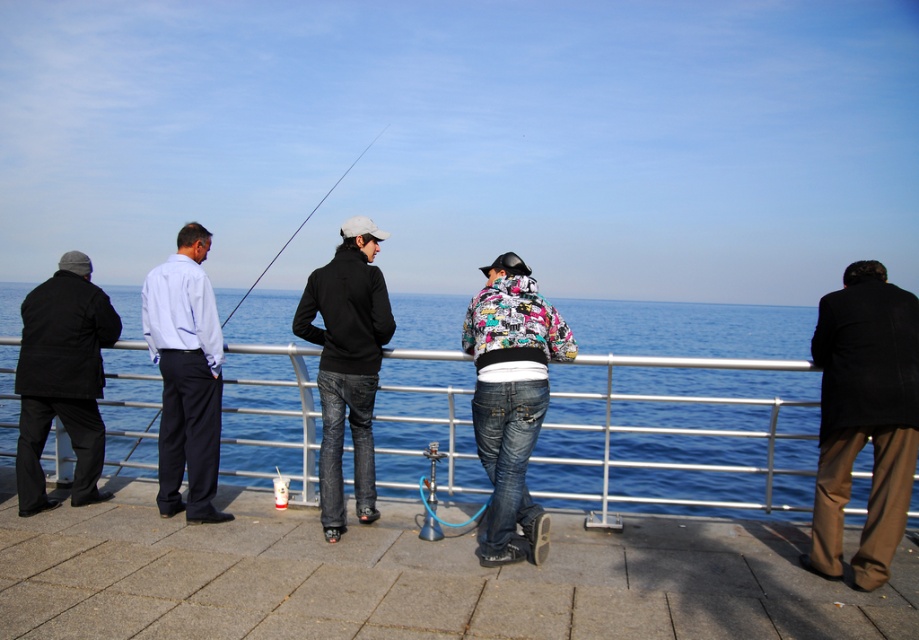
In the scene shown: Is concrete dock at center positioned behind black matte jacket at center?

That is False.

Which is below, concrete dock at center or black matte jacket at center?

concrete dock at center

Does point (290, 512) come behind point (316, 305)?

Yes.

This screenshot has height=640, width=919. Identify the location of concrete dock at center. click(416, 579).

The image size is (919, 640). I want to click on concrete dock at center, so click(416, 579).

Which is behind, point (640, 552) or point (89, 458)?

The point (89, 458) is more distant.

What are the coordinates of `concrete dock at center` in the screenshot? It's located at (416, 579).

Who is positioned more to the right, concrete dock at center or brown woolen coat at right?

brown woolen coat at right

In the scene shown: Who is more forward, (183, 621) or (905, 317)?

Point (183, 621) is more forward.

Where is `concrete dock at center`? This screenshot has height=640, width=919. concrete dock at center is located at coordinates (416, 579).